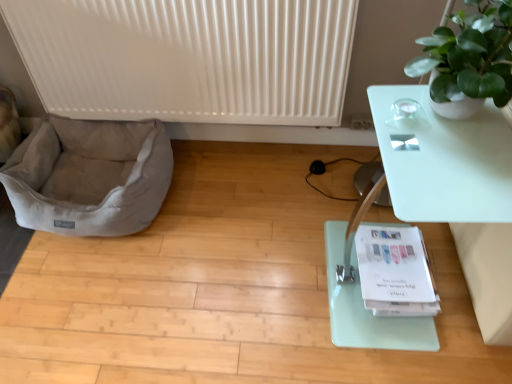
The height and width of the screenshot is (384, 512). I want to click on transparent glass table at right, so 458,194.

Measure the distance between point (x=61, y=86) and camera.

Point (x=61, y=86) and camera are 1.66 meters apart.

Locate an element on the screen. The image size is (512, 384). white paper yoga mat at lower center is located at coordinates (367, 310).

Where is `transparent glass table at right`? This screenshot has width=512, height=384. transparent glass table at right is located at coordinates (458, 194).

Does transparent glass table at right have a smaller size compared to white paper yoga mat at lower center?

Incorrect, transparent glass table at right is not smaller in size than white paper yoga mat at lower center.

Can you confirm if transparent glass table at right is positioned to the right of white paper yoga mat at lower center?

Incorrect, transparent glass table at right is not on the right side of white paper yoga mat at lower center.

Does transparent glass table at right have a greater width compared to white paper yoga mat at lower center?

Yes, transparent glass table at right is wider than white paper yoga mat at lower center.

Is green matte plant at upper right oriented towards light gray fabric dog bed at lower left?

No, green matte plant at upper right is not aimed at light gray fabric dog bed at lower left.

Does green matte plant at upper right appear on the left side of light gray fabric dog bed at lower left?

No.

Considering the relative sizes of green matte plant at upper right and light gray fabric dog bed at lower left in the image provided, is green matte plant at upper right wider than light gray fabric dog bed at lower left?

No.

What's the angular difference between white ribbed radiator at upper center and white paper yoga mat at lower center's facing directions?

white ribbed radiator at upper center and white paper yoga mat at lower center are facing 0.453 degrees away from each other.

In terms of height, does white ribbed radiator at upper center look taller or shorter compared to white paper yoga mat at lower center?

Considering their sizes, white ribbed radiator at upper center has more height than white paper yoga mat at lower center.

The image size is (512, 384). I want to click on radiator that is above the white paper yoga mat at lower center (from a real-world perspective), so click(188, 58).

Considering the positions of points (193, 58) and (351, 261), is point (193, 58) farther from camera compared to point (351, 261)?

Yes, it is.

In the scene shown: From a real-world perspective, which object stands above the other?

In real-world perspective, white ribbed radiator at upper center is above.

Which is more to the right, light gray fabric dog bed at lower left or white ribbed radiator at upper center?

white ribbed radiator at upper center is more to the right.

Is point (73, 182) in front of point (56, 82)?

No, it is not.

Is light gray fabric dog bed at lower left oriented towards white ribbed radiator at upper center?

No, light gray fabric dog bed at lower left does not turn towards white ribbed radiator at upper center.

From a real-world perspective, is green matte plant at upper right on transparent glass table at right?

Yes, from a real-world perspective, green matte plant at upper right is on top of transparent glass table at right.

From the image's perspective, relative to transparent glass table at right, is green matte plant at upper right above or below?

From the image's perspective, green matte plant at upper right appears above transparent glass table at right.

Is green matte plant at upper right beside transparent glass table at right?

No, green matte plant at upper right is not beside transparent glass table at right.

Is green matte plant at upper right oriented away from transparent glass table at right?

No, green matte plant at upper right is not facing the opposite direction of transparent glass table at right.

Is white paper yoga mat at lower center with light gray fabric dog bed at lower left?

No, white paper yoga mat at lower center is not in contact with light gray fabric dog bed at lower left.

Is white paper yoga mat at lower center facing towards light gray fabric dog bed at lower left?

No, white paper yoga mat at lower center is not oriented towards light gray fabric dog bed at lower left.

Does white paper yoga mat at lower center have a lesser width compared to light gray fabric dog bed at lower left?

Yes, white paper yoga mat at lower center is thinner than light gray fabric dog bed at lower left.

Who is bigger, white paper yoga mat at lower center or light gray fabric dog bed at lower left?

Bigger between the two is light gray fabric dog bed at lower left.

Is point (425, 349) closer to viewer compared to point (498, 95)?

No, (425, 349) is behind (498, 95).

Does white paper yoga mat at lower center contain green matte plant at upper right?

No.

Can you confirm if white paper yoga mat at lower center is positioned to the right of green matte plant at upper right?

No.

From a real-world perspective, is white paper yoga mat at lower center positioned above or below green matte plant at upper right?

In terms of real-world spatial position, white paper yoga mat at lower center is below green matte plant at upper right.

At what (x,y) coordinates should I click in order to perform the action: click on yoga mat behind the transparent glass table at right. Please return your answer as a coordinate pair (x, y). The image size is (512, 384). Looking at the image, I should click on (367, 310).

Find the location of a particular element. houseplant on the right of light gray fabric dog bed at lower left is located at coordinates (469, 60).

Estimate the real-world distances between objects in this image. Which object is closer to white ribbed radiator at upper center, white paper yoga mat at lower center or green matte plant at upper right?

green matte plant at upper right is closer to white ribbed radiator at upper center.

Considering their positions, is light gray fabric dog bed at lower left positioned further to white ribbed radiator at upper center than green matte plant at upper right?

green matte plant at upper right lies further to white ribbed radiator at upper center than the other object.

Considering their positions, is light gray fabric dog bed at lower left positioned closer to white paper yoga mat at lower center than green matte plant at upper right?

Based on the image, green matte plant at upper right appears to be nearer to white paper yoga mat at lower center.

Estimate the real-world distances between objects in this image. Which object is closer to light gray fabric dog bed at lower left, transparent glass table at right or white ribbed radiator at upper center?

white ribbed radiator at upper center is positioned closer to the anchor light gray fabric dog bed at lower left.

Considering their positions, is green matte plant at upper right positioned closer to transparent glass table at right than white ribbed radiator at upper center?

Among the two, green matte plant at upper right is located nearer to transparent glass table at right.

From the image, which object appears to be nearer to light gray fabric dog bed at lower left, white ribbed radiator at upper center or green matte plant at upper right?

white ribbed radiator at upper center lies closer to light gray fabric dog bed at lower left than the other object.

Considering their positions, is white paper yoga mat at lower center positioned closer to transparent glass table at right than white ribbed radiator at upper center?

white paper yoga mat at lower center is positioned closer to the anchor transparent glass table at right.

When comparing their distances from transparent glass table at right, does green matte plant at upper right or white paper yoga mat at lower center seem further?

Among the two, white paper yoga mat at lower center is located further to transparent glass table at right.

Identify the location of yoga mat between white ribbed radiator at upper center and green matte plant at upper right. click(367, 310).

I want to click on radiator between light gray fabric dog bed at lower left and green matte plant at upper right in the horizontal direction, so click(188, 58).

I want to click on table between green matte plant at upper right and white paper yoga mat at lower center in the up-down direction, so click(458, 194).

Find the location of `radiator between light gray fabric dog bed at lower left and white paper yoga mat at lower center from left to right`. radiator between light gray fabric dog bed at lower left and white paper yoga mat at lower center from left to right is located at coordinates (188, 58).